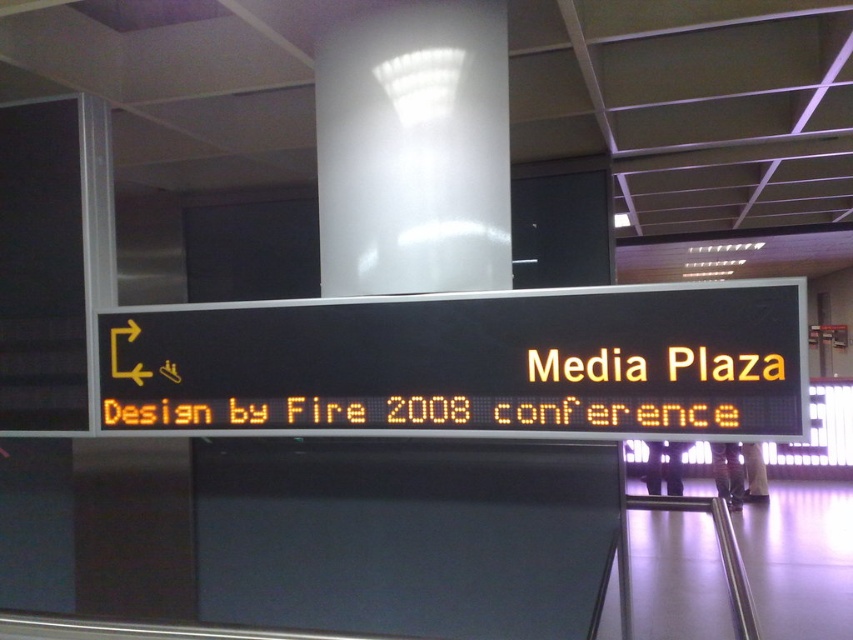
Question: Does yellow led display at center lie in front of white glossy pillar at upper center?

Choices:
 (A) no
 (B) yes

Answer: (B)

Question: Which point appears farthest from the camera in this image?

Choices:
 (A) [x=322, y=124]
 (B) [x=132, y=388]

Answer: (B)

Question: Is yellow led display at center above white glossy pillar at upper center?

Choices:
 (A) no
 (B) yes

Answer: (A)

Question: Does yellow led display at center appear on the right side of white glossy pillar at upper center?

Choices:
 (A) no
 (B) yes

Answer: (B)

Question: Among these points, which one is farthest from the camera?

Choices:
 (A) (244, 360)
 (B) (416, 208)

Answer: (A)

Question: Which point is closer to the camera?

Choices:
 (A) (485, 355)
 (B) (460, 38)

Answer: (A)